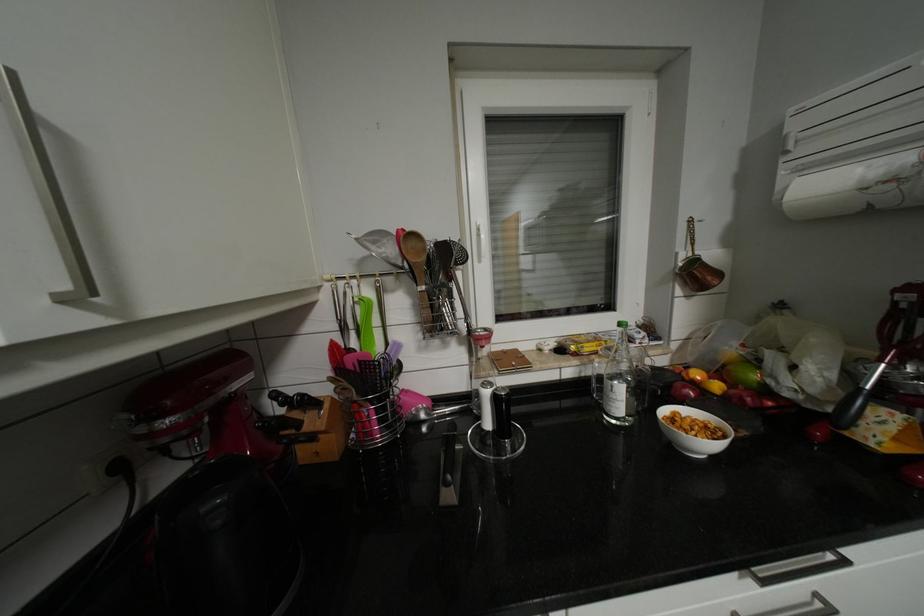
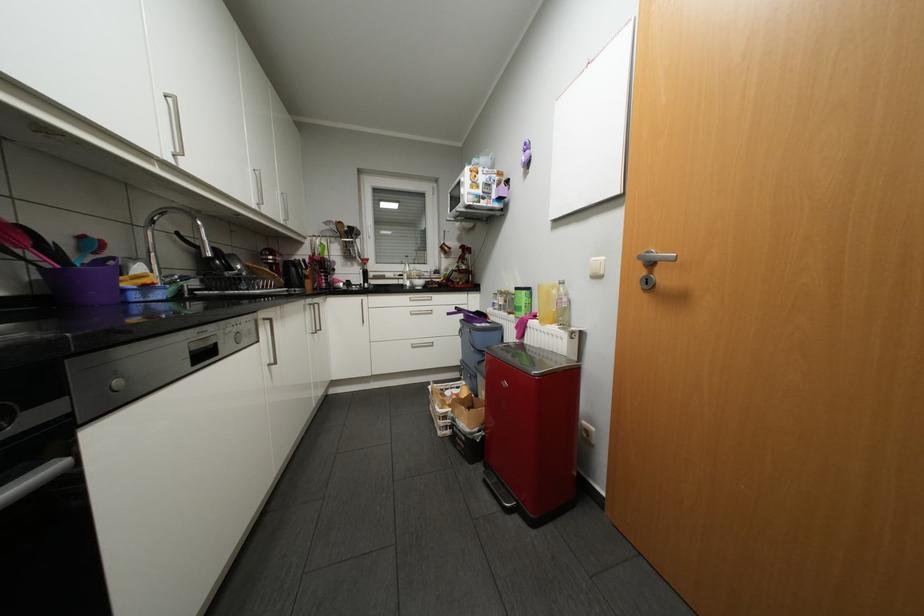
Question: What movement of the cameraman would produce the second image?

Choices:
 (A) Left
 (B) Right
 (C) Forward
 (D) Backward

Answer: (D)